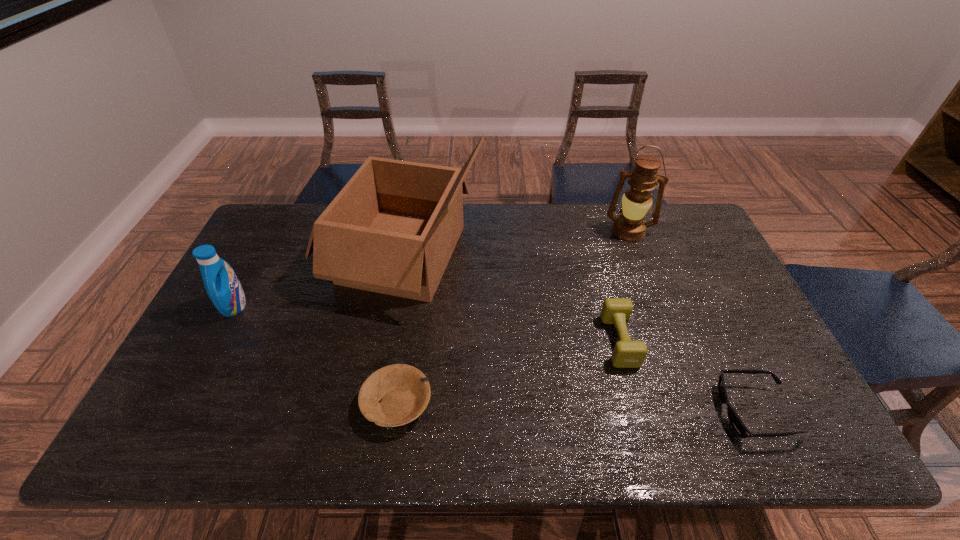
Find the location of a particular element. This screenshot has width=960, height=540. object located at the left edge is located at coordinates (223, 287).

In order to click on object present at the right edge in this screenshot , I will do `click(738, 426)`.

Identify the location of object that is positioned at the near right corner. (738, 426).

In the image, there is a desktop. Where is `free region at the far edge`? This screenshot has height=540, width=960. free region at the far edge is located at coordinates (565, 231).

In the image, there is a desktop. Where is `free space at the near edge`? free space at the near edge is located at coordinates (684, 446).

Image resolution: width=960 pixels, height=540 pixels. In the image, there is a desktop. What are the coordinates of `blank space at the left edge` in the screenshot? It's located at (205, 395).

In the image, there is a desktop. Where is `free space at the right edge`? free space at the right edge is located at coordinates (745, 375).

Where is `free space at the far left corner`? This screenshot has width=960, height=540. free space at the far left corner is located at coordinates (279, 216).

The height and width of the screenshot is (540, 960). I want to click on vacant space at the near right corner of the desktop, so click(795, 448).

You are a GUI agent. You are given a task and a screenshot of the screen. Output one action in this format:
    pyautogui.click(x=<x>, y=<y>)
    Task: Click on the free space between the oil lamp and the box
    
    Given the screenshot: What is the action you would take?
    pyautogui.click(x=516, y=242)